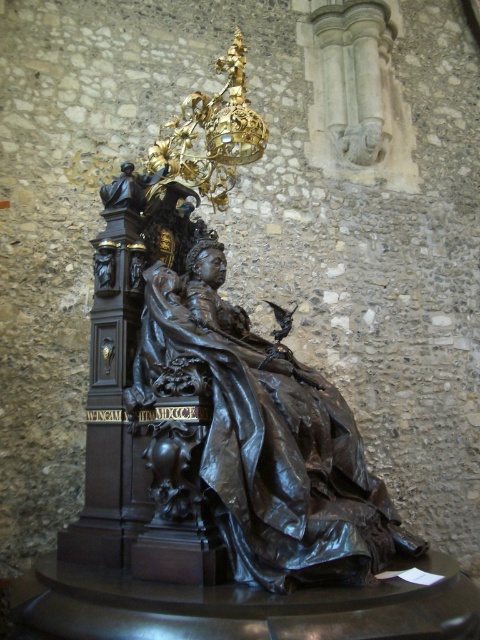
Between point (189, 385) and point (227, 397), which one is positioned behind?

Positioned behind is point (227, 397).

Can you confirm if bronze statue at center is taller than shiny bronze statue at center?

Yes.

The width and height of the screenshot is (480, 640). What are the coordinates of `bronze statue at center` in the screenshot? It's located at (212, 394).

Where is `bronze statue at center`? bronze statue at center is located at coordinates (212, 394).